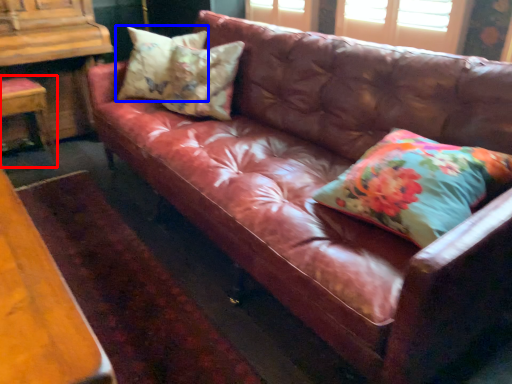
Question: Among these objects, which one is nearest to the camera, chair (highlighted by a red box) or pillow (highlighted by a blue box)?

Choices:
 (A) chair
 (B) pillow

Answer: (B)